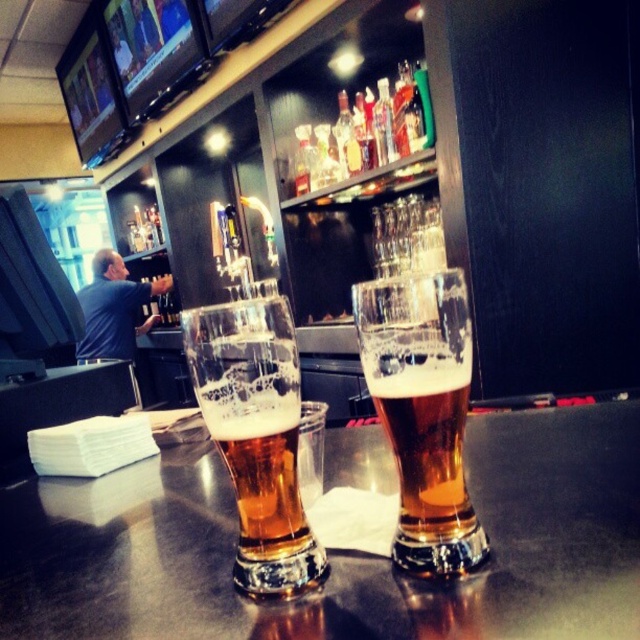
You are a bartender trying to clean the bar. You need to reach a spot on the bar that is at point (x=204, y=586). Your longest cleaning tool is 18 inches long. Can you reach that spot with your tool?

The point (x=204, y=586) is 18.89 inches away from the camera, so your 18 inch tool is too short to reach it.

You are a bartender who needs to place a coaster under the golden glass beer at center to prevent damage to the translucent glass table at center. Is the coaster already placed correctly underneath the beer glass?

The translucent glass table at center is below golden glass beer at center, which means the coaster is already placed correctly underneath the golden glass beer at center to protect the table.

You are a bartender who needs to place a coaster under the translucent glass beer at center to prevent damage to the counter. Given that the coaster has a diameter of 10 cm, and the counter space around the glass is clear for 15 cm in all directions, will the coaster fit without overlapping any other objects?

The translucent glass beer at center is located at point [257,435]. Since the coaster has a diameter of 10 cm and the counter space around the glass is clear for 15 cm in all directions, the coaster will fit without overlapping any other objects because the clear space is larger than the coaster.